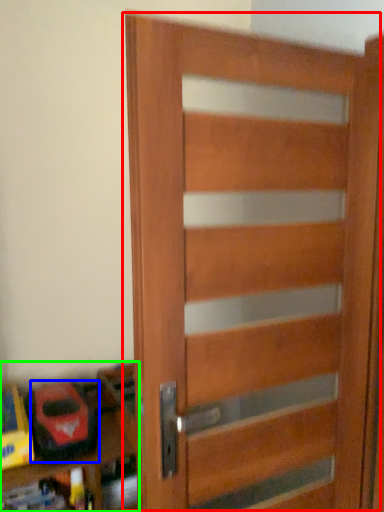
Question: Estimate the real-world distances between objects in this image. Which object is farther from door (highlighted by a red box), toy (highlighted by a blue box) or shelf (highlighted by a green box)?

Choices:
 (A) toy
 (B) shelf

Answer: (A)